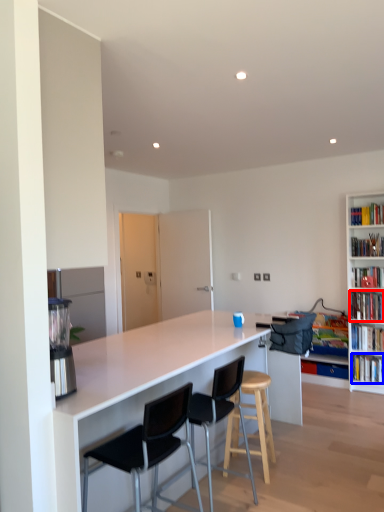
Question: Which object is closer to the camera taking this photo, book (highlighted by a red box) or book (highlighted by a blue box)?

Choices:
 (A) book
 (B) book

Answer: (A)